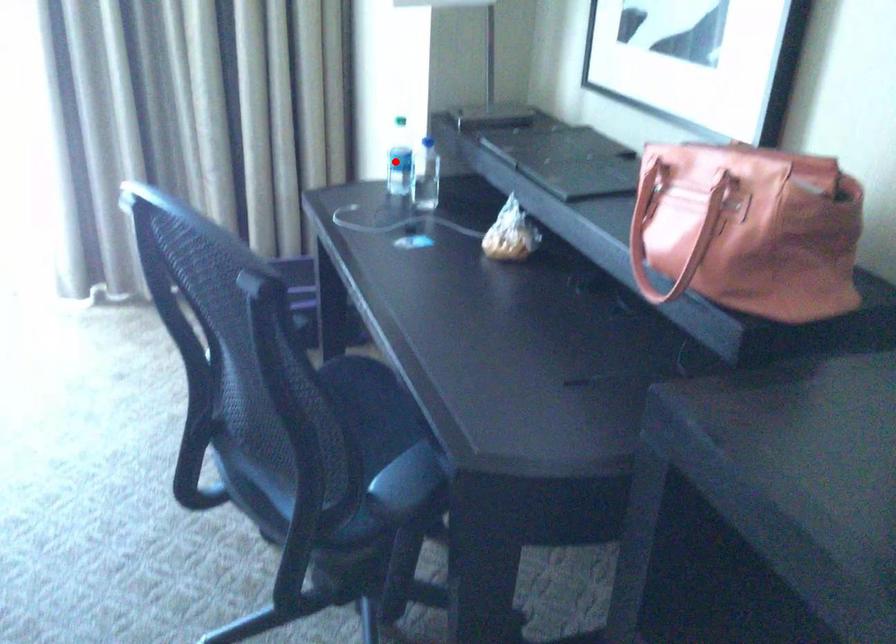
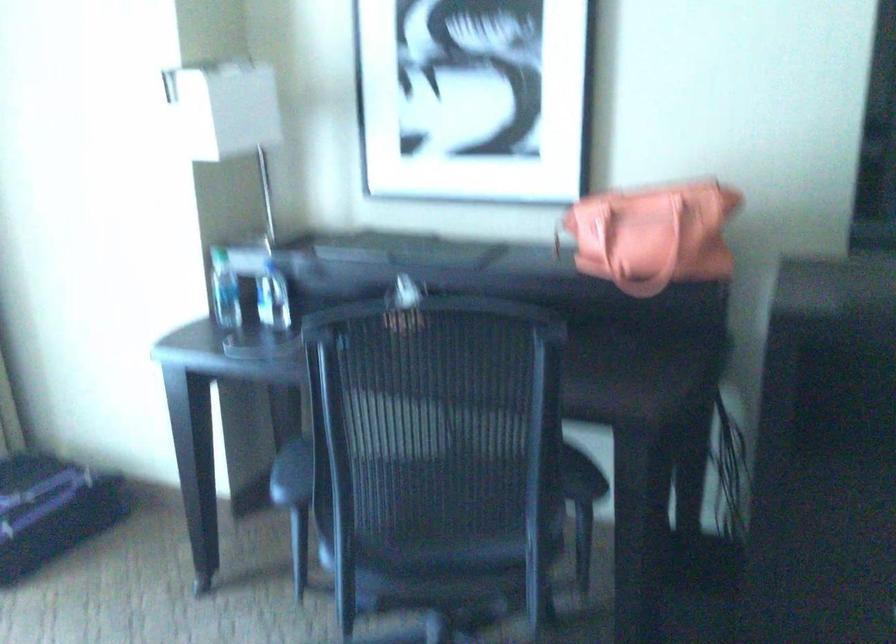
The point at the highlighted location is marked in the first image. Where is the corresponding point in the second image?

(225, 290)